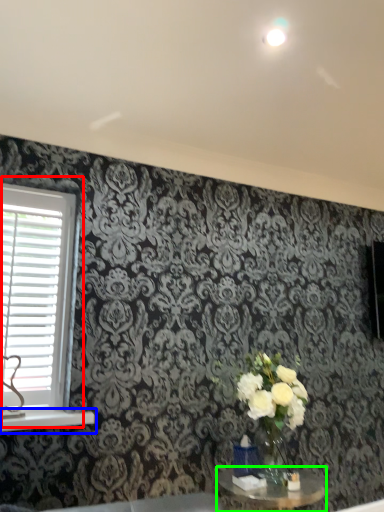
Question: Which object is the closest to the window (highlighted by a red box)? Choose among these: window sill (highlighted by a blue box) or table (highlighted by a green box).

Choices:
 (A) window sill
 (B) table

Answer: (A)